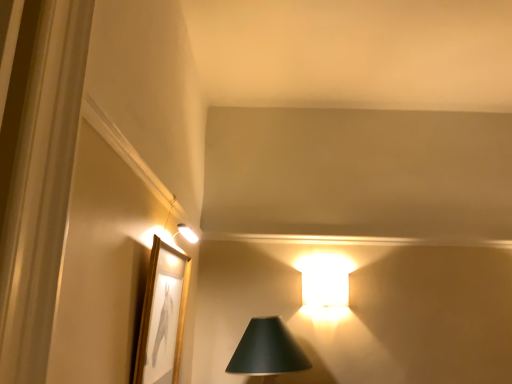
Locate an element on the screen. Image resolution: width=512 pixels, height=384 pixels. matte black lampshade at lower center is located at coordinates (267, 351).

Describe the element at coordinates (267, 351) in the screenshot. This screenshot has height=384, width=512. I see `matte black lampshade at lower center` at that location.

This screenshot has width=512, height=384. What do you see at coordinates (162, 316) in the screenshot? I see `gold/glossy picture frame at upper left` at bounding box center [162, 316].

Image resolution: width=512 pixels, height=384 pixels. I want to click on gold/glossy picture frame at upper left, so click(x=162, y=316).

Locate an element on the screen. matte black lampshade at lower center is located at coordinates (267, 351).

Between matte black lampshade at lower center and gold/glossy picture frame at upper left, which one appears on the right side from the viewer's perspective?

From the viewer's perspective, matte black lampshade at lower center appears more on the right side.

Which object is closer to the camera taking this photo, matte black lampshade at lower center or gold/glossy picture frame at upper left?

Positioned in front is gold/glossy picture frame at upper left.

Which is farther, (268, 358) or (146, 332)?

Point (268, 358)

From the image's perspective, who appears lower, matte black lampshade at lower center or gold/glossy picture frame at upper left?

matte black lampshade at lower center, from the image's perspective.

From a real-world perspective, who is located lower, matte black lampshade at lower center or gold/glossy picture frame at upper left?

In real-world perspective, matte black lampshade at lower center is lower.

Looking at this image, considering the relative sizes of matte black lampshade at lower center and gold/glossy picture frame at upper left in the image provided, is matte black lampshade at lower center wider than gold/glossy picture frame at upper left?

Indeed, matte black lampshade at lower center has a greater width compared to gold/glossy picture frame at upper left.

Is matte black lampshade at lower center shorter than gold/glossy picture frame at upper left?

Indeed, matte black lampshade at lower center has a lesser height compared to gold/glossy picture frame at upper left.

Is matte black lampshade at lower center smaller than gold/glossy picture frame at upper left?

No.

Consider the image. Is matte black lampshade at lower center situated inside gold/glossy picture frame at upper left or outside?

matte black lampshade at lower center is not inside gold/glossy picture frame at upper left, it's outside.

Are matte black lampshade at lower center and gold/glossy picture frame at upper left making contact?

No, matte black lampshade at lower center is not making contact with gold/glossy picture frame at upper left.

Looking at this image, is matte black lampshade at lower center oriented away from gold/glossy picture frame at upper left?

matte black lampshade at lower center does not have its back to gold/glossy picture frame at upper left.

The height and width of the screenshot is (384, 512). I want to click on lamp lying below the gold/glossy picture frame at upper left (from the image's perspective), so click(x=267, y=351).

Considering the relative positions of gold/glossy picture frame at upper left and matte black lampshade at lower center in the image provided, is gold/glossy picture frame at upper left to the left or to the right of matte black lampshade at lower center?

In the image, gold/glossy picture frame at upper left appears on the left side of matte black lampshade at lower center.

Between gold/glossy picture frame at upper left and matte black lampshade at lower center, which one is positioned behind?

matte black lampshade at lower center is further away from the camera.

Which is behind, point (150, 373) or point (256, 340)?

The point (256, 340) is behind.

From the image's perspective, is gold/glossy picture frame at upper left over matte black lampshade at lower center?

Indeed, from the image's perspective, gold/glossy picture frame at upper left is shown above matte black lampshade at lower center.

From a real-world perspective, is gold/glossy picture frame at upper left above or below matte black lampshade at lower center?

In terms of real-world spatial position, gold/glossy picture frame at upper left is above matte black lampshade at lower center.

Looking at their sizes, would you say gold/glossy picture frame at upper left is wider or thinner than matte black lampshade at lower center?

gold/glossy picture frame at upper left is thinner than matte black lampshade at lower center.

Does gold/glossy picture frame at upper left have a lesser height compared to matte black lampshade at lower center?

Incorrect, the height of gold/glossy picture frame at upper left does not fall short of that of matte black lampshade at lower center.

Based on their sizes in the image, would you say gold/glossy picture frame at upper left is bigger or smaller than matte black lampshade at lower center?

Clearly, gold/glossy picture frame at upper left is smaller in size than matte black lampshade at lower center.

Which is correct: gold/glossy picture frame at upper left is inside matte black lampshade at lower center, or outside of it?

gold/glossy picture frame at upper left cannot be found inside matte black lampshade at lower center.

Are gold/glossy picture frame at upper left and matte black lampshade at lower center located far from each other?

gold/glossy picture frame at upper left is actually quite close to matte black lampshade at lower center.

Is gold/glossy picture frame at upper left looking in the opposite direction of matte black lampshade at lower center?

gold/glossy picture frame at upper left does not have its back to matte black lampshade at lower center.

This screenshot has height=384, width=512. What are the coordinates of `lamp that is under the gold/glossy picture frame at upper left (from a real-world perspective)` in the screenshot? It's located at (267, 351).

Where is `picture frame above the matte black lampshade at lower center (from a real-world perspective)`? The height and width of the screenshot is (384, 512). picture frame above the matte black lampshade at lower center (from a real-world perspective) is located at coordinates [162, 316].

Where is `lamp that appears behind the gold/glossy picture frame at upper left`? The image size is (512, 384). lamp that appears behind the gold/glossy picture frame at upper left is located at coordinates (267, 351).